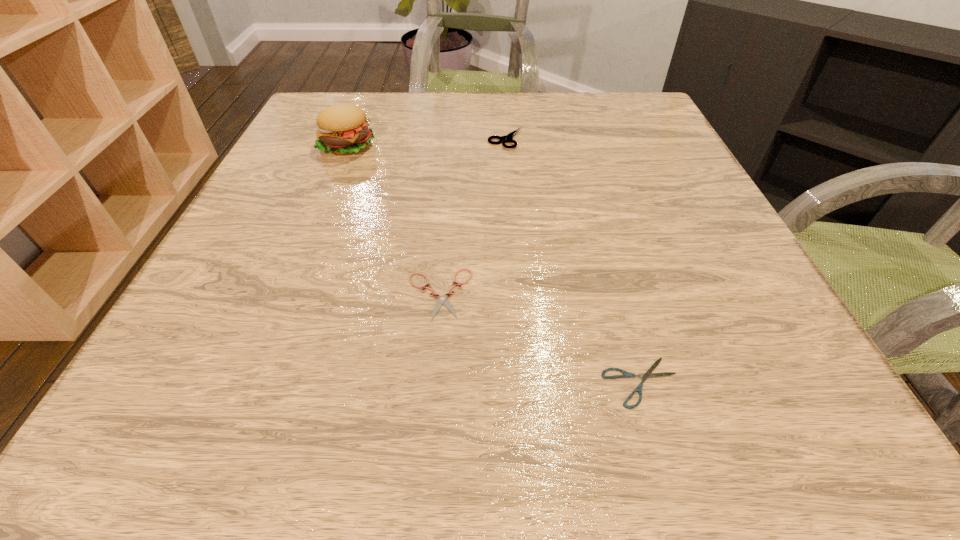
Locate an element on the screen. blank area located on the front of the second nearest shears is located at coordinates (431, 391).

Identify the location of free space located 0.270m on the back of the nearest object. The width and height of the screenshot is (960, 540). (596, 227).

Image resolution: width=960 pixels, height=540 pixels. I want to click on hamburger that is at the far edge, so click(x=342, y=129).

Where is `shears situated at the far edge`? This screenshot has height=540, width=960. shears situated at the far edge is located at coordinates (507, 138).

Find the location of a particular element. This screenshot has width=960, height=540. object at the near edge is located at coordinates (648, 374).

Image resolution: width=960 pixels, height=540 pixels. What are the coordinates of `object present at the left edge` in the screenshot? It's located at (342, 129).

Locate an element on the screen. This screenshot has height=540, width=960. object positioned at the far left corner is located at coordinates (342, 129).

I want to click on vacant area at the far edge of the desktop, so click(577, 102).

The height and width of the screenshot is (540, 960). I want to click on vacant space at the left edge of the desktop, so click(x=261, y=250).

Locate an element on the screen. The height and width of the screenshot is (540, 960). free space at the right edge is located at coordinates (x=692, y=314).